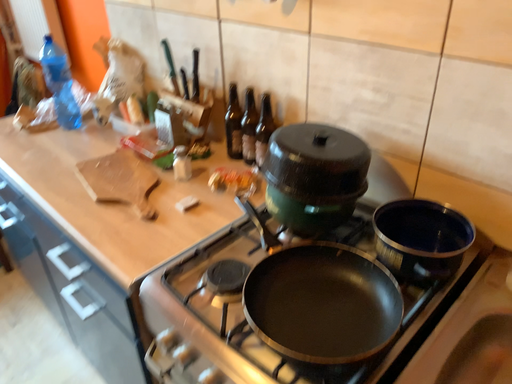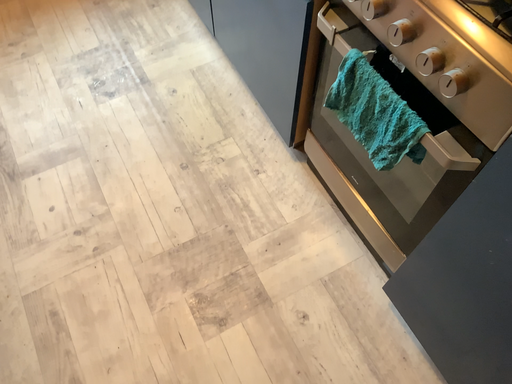
Question: Which way did the camera rotate in the video?

Choices:
 (A) rotated right
 (B) rotated left

Answer: (B)